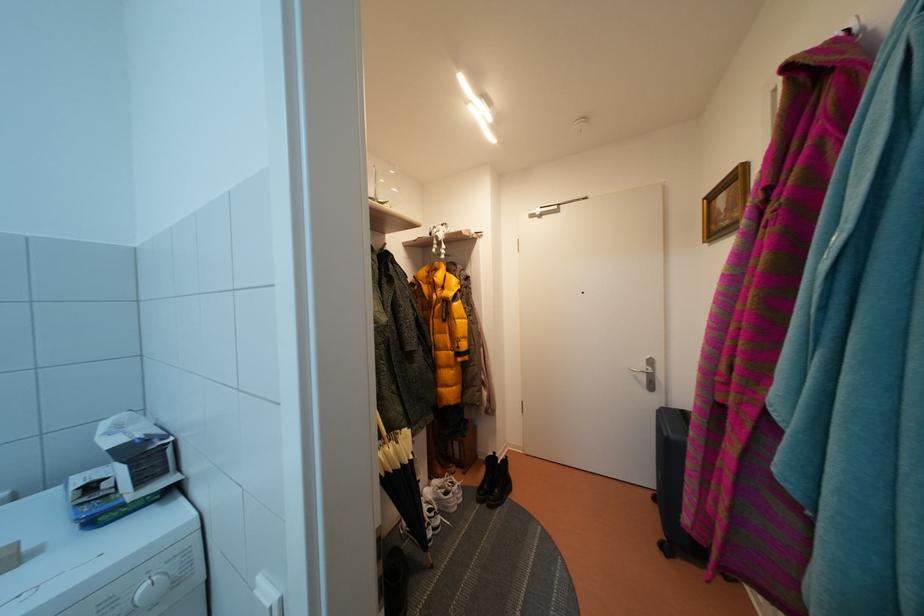
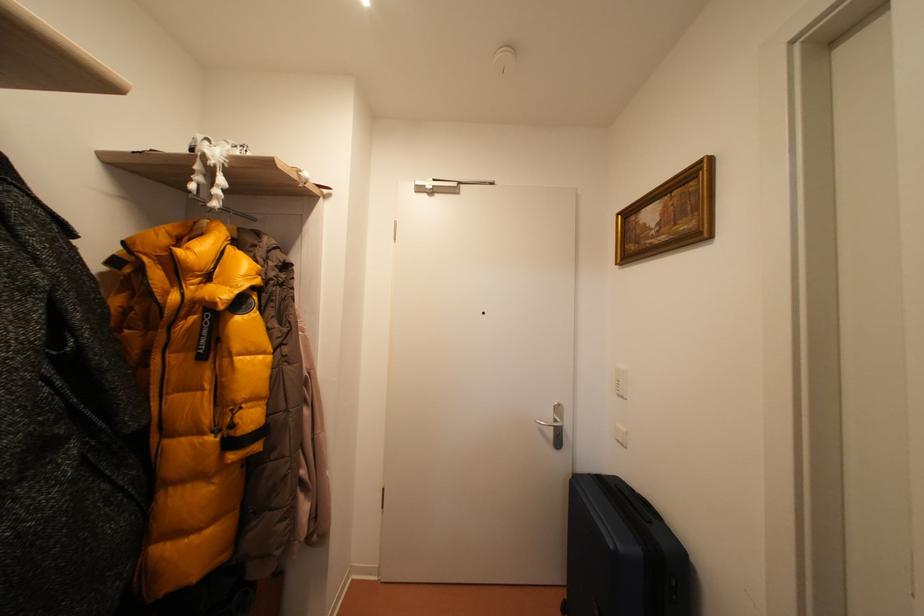
Question: The images are taken continuously from a first-person perspective. In which direction is your viewpoint rotating?

Choices:
 (A) Left
 (B) Right
 (C) Up
 (D) Down

Answer: (B)